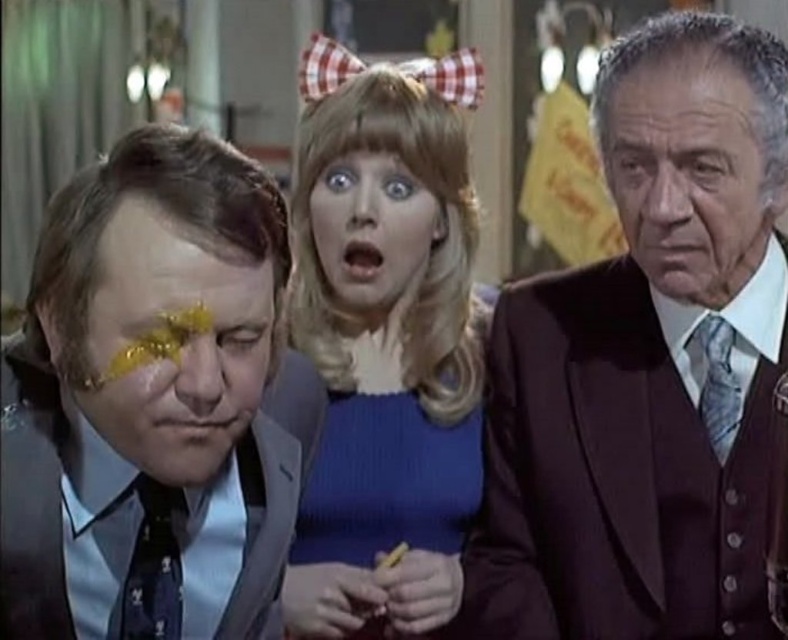
Question: Is smooth skin face at center below dark blue textured tie at left?

Choices:
 (A) no
 (B) yes

Answer: (A)

Question: Which of the following is the farthest from the observer?

Choices:
 (A) shiny gold face at left
 (B) smooth blonde hair at center
 (C) smooth skin face at center

Answer: (B)

Question: Which point is farther to the camera?

Choices:
 (A) (97, 548)
 (B) (143, 468)
 (C) (710, 419)
 (D) (701, 253)

Answer: (C)

Question: Which object is farther from the camera taking this photo?

Choices:
 (A) silky blue tie at right
 (B) maroon wool suit at right
 (C) blue ribbed sweater at center
 (D) smooth blonde hair at center

Answer: (D)

Question: Does matte gray suit at left appear on the left side of dark blue textured tie at left?

Choices:
 (A) yes
 (B) no

Answer: (B)

Question: Where is maroon wool suit at right located in relation to smooth blonde hair at center in the image?

Choices:
 (A) left
 (B) right

Answer: (B)